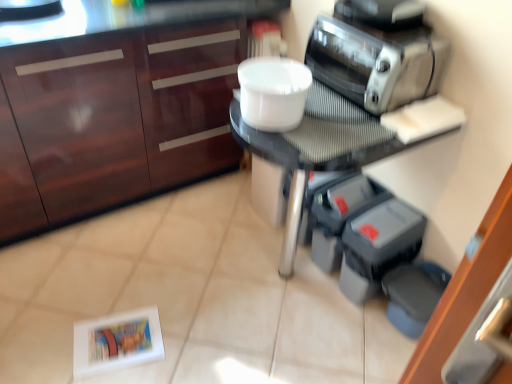
You are a GUI agent. You are given a task and a screenshot of the screen. Output one action in this format:
    pyautogui.click(x=<x>, y=<y>)
    Task: Click on the vacant area situated below matte black table at center (from a real-world perspective)
    This screenshot has width=512, height=384.
    Given the screenshot: What is the action you would take?
    pyautogui.click(x=278, y=278)